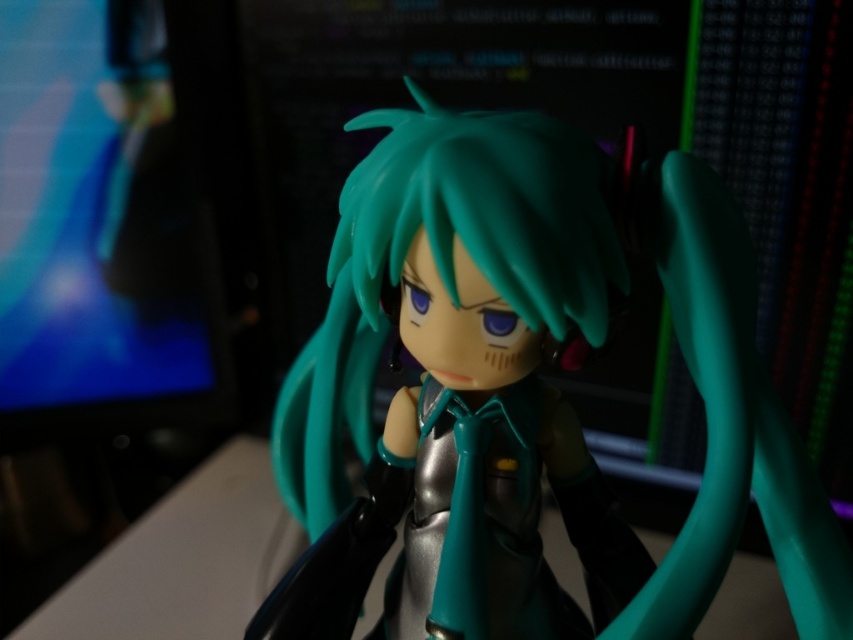
Is matte black monitor at left closer to camera compared to teal glossy hair at center?

No, it is not.

Find the location of a particular element. This screenshot has height=640, width=853. matte black monitor at left is located at coordinates (100, 230).